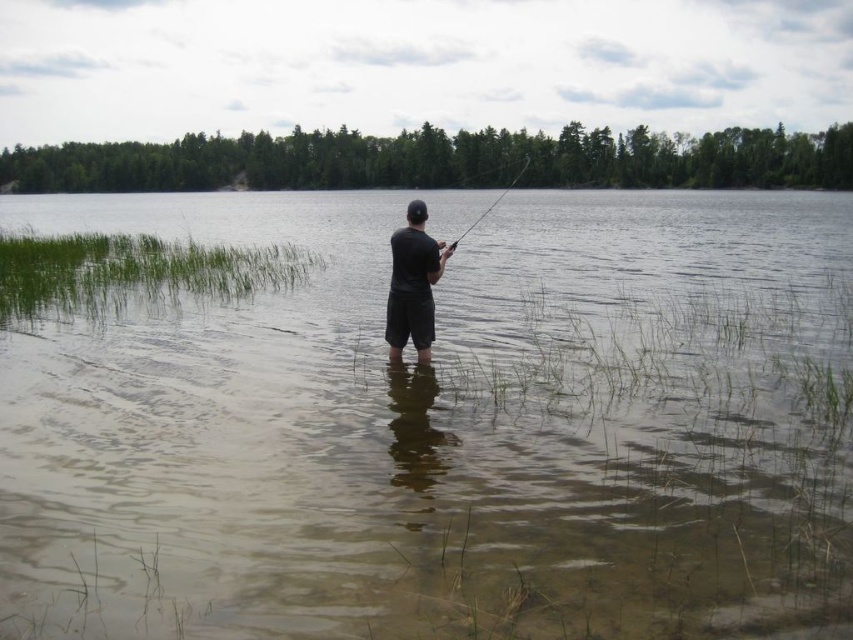
Question: Which point is closer to the camera?

Choices:
 (A) (405, 332)
 (B) (518, 176)

Answer: (A)

Question: Estimate the real-world distances between objects in this image. Which object is closer to the black matte shorts at center?

Choices:
 (A) brown murky water at center
 (B) smooth black rod at center

Answer: (B)

Question: Can you confirm if black matte shorts at center is positioned to the left of smooth black rod at center?

Choices:
 (A) yes
 (B) no

Answer: (A)

Question: Does black matte shorts at center appear under smooth black rod at center?

Choices:
 (A) no
 (B) yes

Answer: (B)

Question: Observing the image, what is the correct spatial positioning of brown murky water at center in reference to black matte shorts at center?

Choices:
 (A) above
 (B) below

Answer: (A)

Question: Among these objects, which one is farthest from the camera?

Choices:
 (A) brown murky water at center
 (B) smooth black rod at center
 (C) black matte shorts at center

Answer: (B)